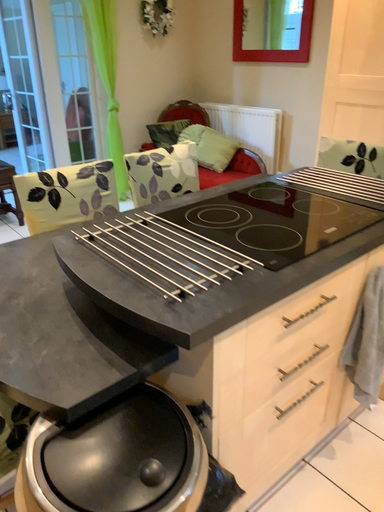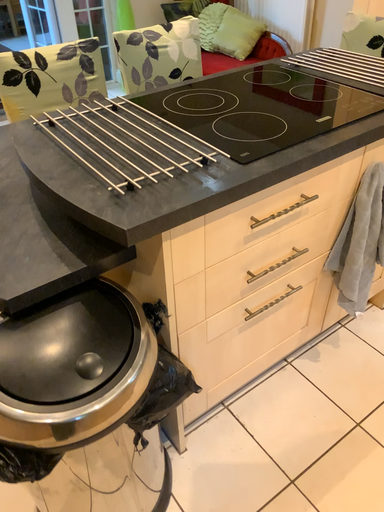
Question: Which way did the camera rotate in the video?

Choices:
 (A) rotated downward
 (B) rotated upward

Answer: (A)